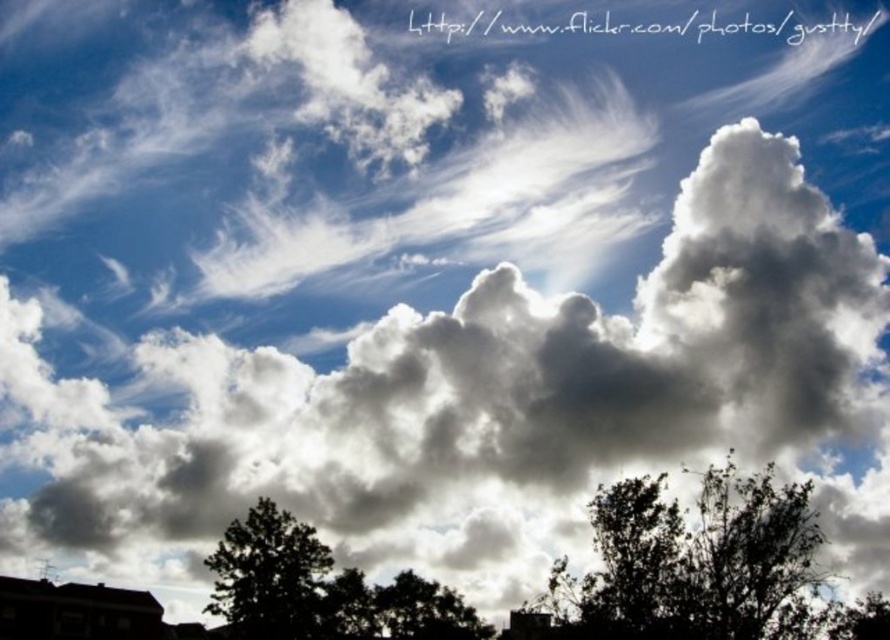
Question: Among these objects, which one is farthest from the camera?

Choices:
 (A) green leafy tree at lower right
 (B) green leafy tree at lower center
 (C) dark green leafy tree at lower left
 (D) dark green leafy tree at lower center

Answer: (B)

Question: Can you confirm if green leafy tree at lower center is positioned to the left of green leafy tree at lower right?

Choices:
 (A) yes
 (B) no

Answer: (A)

Question: Which point is closer to the camera?

Choices:
 (A) (239, 529)
 (B) (863, 618)
 (C) (479, 620)

Answer: (B)

Question: From the image, what is the correct spatial relationship of dark green leafy tree at lower center in relation to green leafy tree at lower right?

Choices:
 (A) right
 (B) left

Answer: (B)

Question: Which object is the closest to the dark green leafy tree at lower left?

Choices:
 (A) dark green leafy tree at lower center
 (B) green leafy tree at lower center

Answer: (B)

Question: Can you confirm if dark green leafy tree at lower left is smaller than green leafy tree at lower center?

Choices:
 (A) yes
 (B) no

Answer: (B)